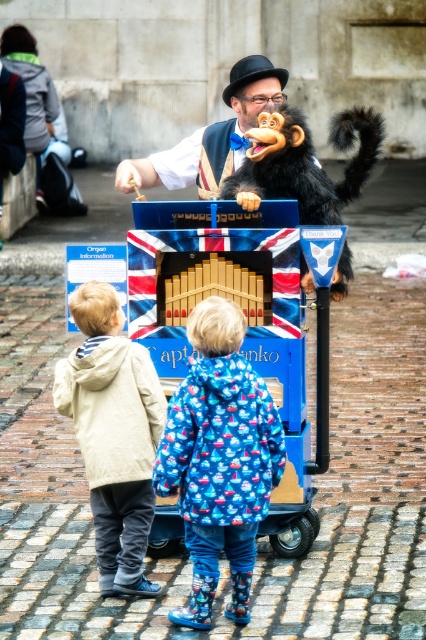
Question: Estimate the real-world distances between objects in this image. Which object is farther from the light beige jacket at lower left?

Choices:
 (A) shiny black fur monkey at center
 (B) union jack painted organ at center
 (C) blue printed coat at center

Answer: (B)

Question: Considering the real-world distances, which object is closest to the shiny black fur monkey at center?

Choices:
 (A) light beige jacket at lower left
 (B) blue printed coat at center

Answer: (B)

Question: Can you confirm if blue painted wooden organ at center is thinner than shiny black fur monkey at center?

Choices:
 (A) no
 (B) yes

Answer: (B)

Question: Is light beige jacket at lower left bigger than union jack painted organ at center?

Choices:
 (A) no
 (B) yes

Answer: (A)

Question: Which object appears farthest from the camera in this image?

Choices:
 (A) union jack painted organ at center
 (B) blue printed coat at center
 (C) light beige jacket at lower left

Answer: (A)

Question: Is light beige jacket at lower left smaller than shiny black fur monkey at center?

Choices:
 (A) yes
 (B) no

Answer: (A)